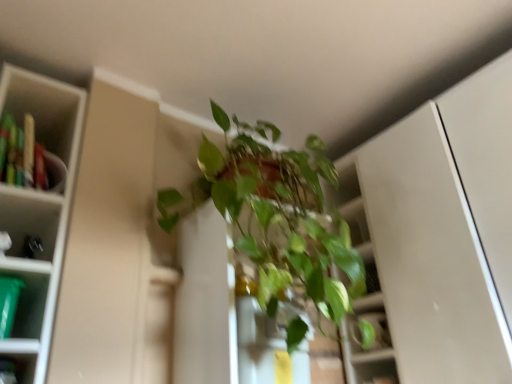
What is the approximate width of green plastic container at left?

green plastic container at left is 5.28 inches in width.

This screenshot has width=512, height=384. What do you see at coordinates (29, 302) in the screenshot? I see `green plastic container at left` at bounding box center [29, 302].

What is the approximate width of green plastic container at left?

The width of green plastic container at left is 6.90 inches.

This screenshot has height=384, width=512. I want to click on green plastic container at left, so click(46, 111).

Considering the positions of objects green plastic container at left and green plastic container at left in the image provided, who is more to the right, green plastic container at left or green plastic container at left?

green plastic container at left.

From the image's perspective, is green plastic container at left located above green plastic container at left?

Indeed, from the image's perspective, green plastic container at left is shown above green plastic container at left.

From their relative heights in the image, would you say green plastic container at left is taller or shorter than green plastic container at left?

Considering their sizes, green plastic container at left has more height than green plastic container at left.

Is green plastic container at left at the left side of green glossy plant at center?

Yes.

From a real-world perspective, who is located higher, green plastic container at left or green glossy plant at center?

In real-world perspective, green glossy plant at center is above.

Is green plastic container at left taller than green glossy plant at center?

No, green plastic container at left is not taller than green glossy plant at center.

Locate an element on the screen. The height and width of the screenshot is (384, 512). shelf below the green glossy plant at center (from a real-world perspective) is located at coordinates (29, 302).

Is green plastic container at left positioned with its back to green glossy plant at center?

No, green plastic container at left is not facing away from green glossy plant at center.

Is green plastic container at left surrounding green glossy plant at center?

No, green glossy plant at center is not surrounded by green plastic container at left.

Based on the photo, from the image's perspective, is green plastic container at left above green glossy plant at center?

Yes, from the image's perspective, green plastic container at left is on top of green glossy plant at center.

Is the surface of green plastic container at left in direct contact with green glossy plant at center?

No, green plastic container at left is not in contact with green glossy plant at center.

Consider the image. Considering the sizes of green glossy plant at center and green plastic container at left in the image, is green glossy plant at center taller or shorter than green plastic container at left?

In the image, green glossy plant at center appears to be taller than green plastic container at left.

Is point (252, 178) positioned in front of point (57, 120)?

Yes, it is.

From the image's perspective, which one is positioned higher, green glossy plant at center or green plastic container at left?

green plastic container at left appears higher in the image.

Is the surface of green glossy plant at center in direct contact with green plastic container at left?

No.

Considering the positions of objects green glossy plant at center and green plastic container at left in the image provided, who is behind, green glossy plant at center or green plastic container at left?

green plastic container at left.

Who is smaller, green glossy plant at center or green plastic container at left?

green plastic container at left.

Does green glossy plant at center touch green plastic container at left?

green glossy plant at center and green plastic container at left are clearly separated.

Is point (332, 239) less distant than point (31, 309)?

No, it is not.

Identify the location of cabinet that is above the green plastic container at left (from the image's perspective). The width and height of the screenshot is (512, 384). (46, 111).

Is point (36, 274) closer or farther from the camera than point (40, 141)?

Clearly, point (36, 274) is closer to the camera than point (40, 141).

Is green plastic container at left facing away from green plastic container at left?

No, green plastic container at left's orientation is not away from green plastic container at left.

Can you confirm if green plastic container at left is shorter than green plastic container at left?

Yes, green plastic container at left is shorter than green plastic container at left.

Find the location of a particular element. The image size is (512, 384). shelf in front of the green plastic container at left is located at coordinates (29, 302).

The height and width of the screenshot is (384, 512). In order to click on shelf below the green glossy plant at center (from the image's perspective) in this screenshot , I will do `click(29, 302)`.

From the image, which object appears to be nearer to green glossy plant at center, green plastic container at left or green plastic container at left?

Among the two, green plastic container at left is located nearer to green glossy plant at center.

Estimate the real-world distances between objects in this image. Which object is closer to green plastic container at left, green plastic container at left or green glossy plant at center?

green plastic container at left lies closer to green plastic container at left than the other object.

Looking at the image, which one is located further to green plastic container at left, green glossy plant at center or green plastic container at left?

green glossy plant at center.

Considering their positions, is green plastic container at left positioned closer to green glossy plant at center than green plastic container at left?

Among the two, green plastic container at left is located nearer to green glossy plant at center.

Looking at the image, which one is located closer to green plastic container at left, green glossy plant at center or green plastic container at left?

green plastic container at left lies closer to green plastic container at left than the other object.

Based on their spatial positions, is green plastic container at left or green glossy plant at center closer to green plastic container at left?

The object closer to green plastic container at left is green plastic container at left.

Locate an element on the screen. The height and width of the screenshot is (384, 512). shelf between green plastic container at left and green glossy plant at center is located at coordinates (29, 302).